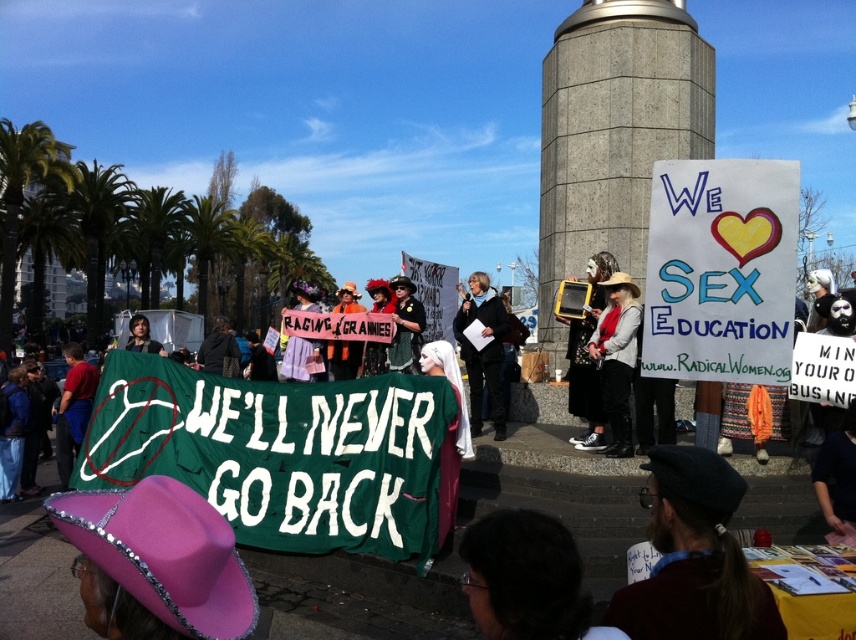
Which is above, black matte jacket at center or yellow plastic sign at center?

black matte jacket at center

Between black matte jacket at center and yellow plastic sign at center, which one has more height?

yellow plastic sign at center is taller.

You are a GUI agent. You are given a task and a screenshot of the screen. Output one action in this format:
    pyautogui.click(x=<x>, y=<y>)
    Task: Click on the black matte jacket at center
    The height and width of the screenshot is (640, 856).
    Given the screenshot: What is the action you would take?
    pyautogui.click(x=483, y=352)

Based on the photo, does white knit sweater at center come in front of black matte jacket at center?

Yes, it is.

Who is positioned more to the right, white knit sweater at center or black matte jacket at center?

From the viewer's perspective, white knit sweater at center appears more on the right side.

What do you see at coordinates (617, 356) in the screenshot? I see `white knit sweater at center` at bounding box center [617, 356].

This screenshot has height=640, width=856. Identify the location of white knit sweater at center. (617, 356).

Is white knit sweater at center to the left of matte black dress at center from the viewer's perspective?

Incorrect, white knit sweater at center is not on the left side of matte black dress at center.

Can you confirm if white knit sweater at center is wider than matte black dress at center?

No, white knit sweater at center is not wider than matte black dress at center.

What do you see at coordinates (617, 356) in the screenshot? I see `white knit sweater at center` at bounding box center [617, 356].

What are the coordinates of `white knit sweater at center` in the screenshot? It's located at (617, 356).